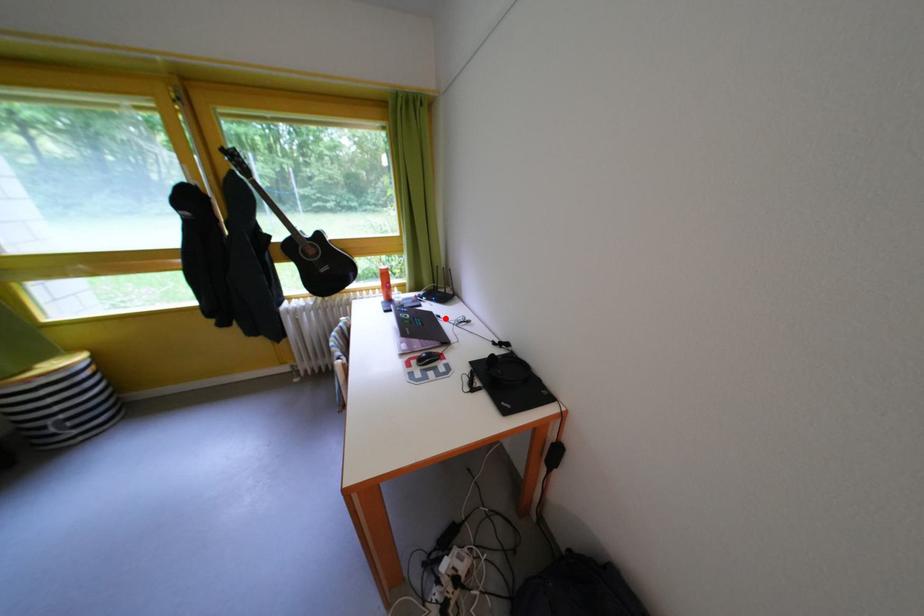
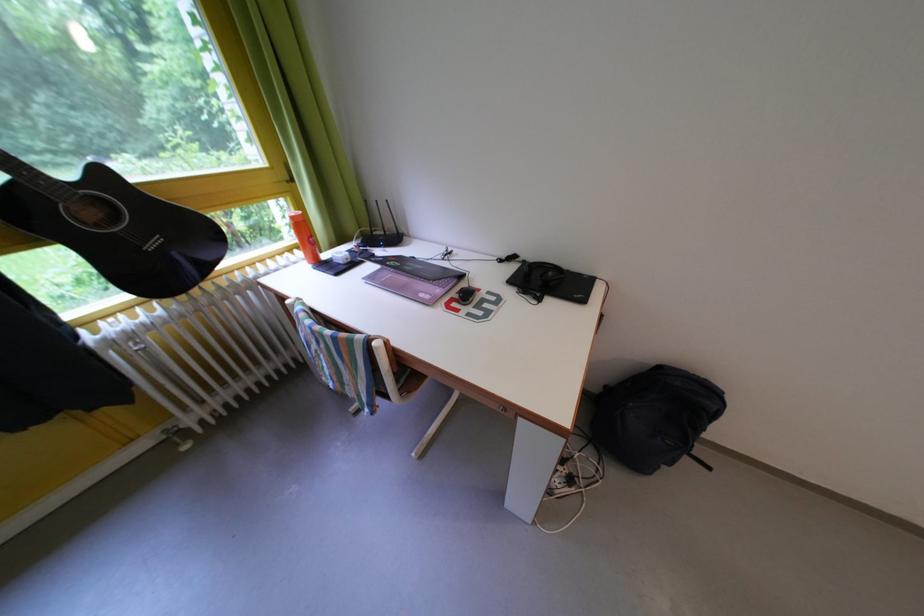
Question: I am providing you with two images of the same scene from different viewpoints. Given a red point in image1, look at the same physical point in image2. Is it:

Choices:
 (A) Closer to the viewpoint
 (B) Farther from the viewpoint

Answer: (B)